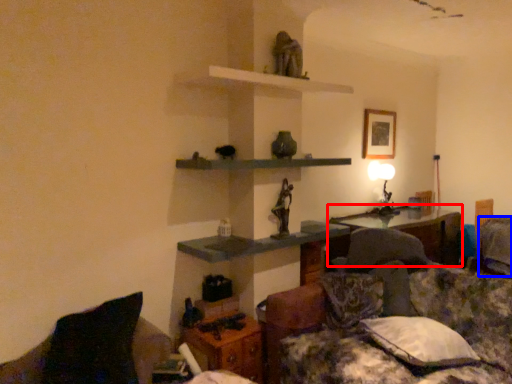
Question: Among these objects, which one is farthest to the camera, table (highlighted by a red box) or pillow (highlighted by a blue box)?

Choices:
 (A) table
 (B) pillow

Answer: (B)